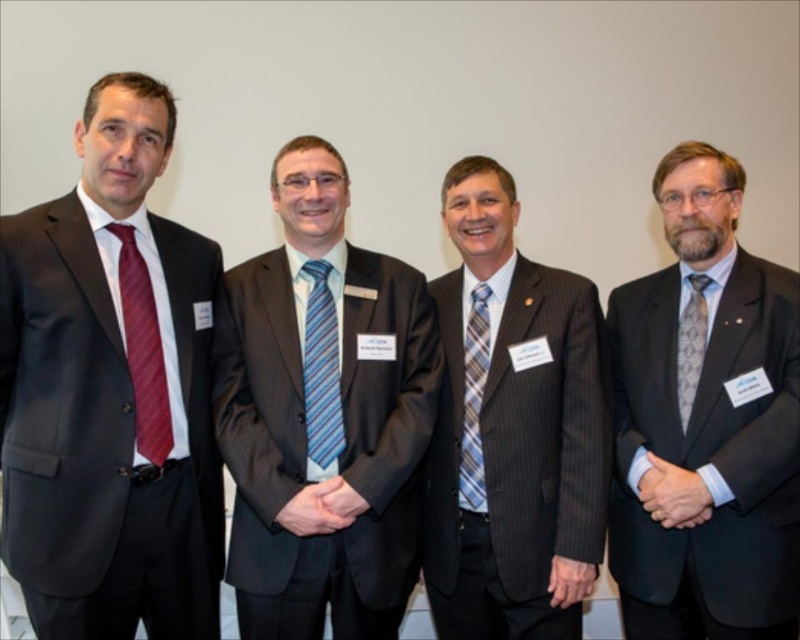
Question: Which point is closer to the camera taking this photo?

Choices:
 (A) (498, 608)
 (B) (329, 198)
 (C) (464, 333)
 (D) (90, 499)

Answer: (D)

Question: Considering the real-world distances, which object is closest to the matte red tie at left?

Choices:
 (A) blue plaid tie at center
 (B) dark gray suit at center
 (C) matte gray suit at right

Answer: (B)

Question: Can you confirm if matte gray suit at right is positioned to the right of blue striped tie at center?

Choices:
 (A) no
 (B) yes

Answer: (B)

Question: Is matte black suit at left wider than blue plaid tie at center?

Choices:
 (A) yes
 (B) no

Answer: (A)

Question: Which point is closer to the camera?

Choices:
 (A) striped fabric suit at center
 (B) matte red tie at left

Answer: (B)

Question: Where is striped fabric suit at center located in relation to blue plaid tie at center in the image?

Choices:
 (A) below
 (B) above

Answer: (A)